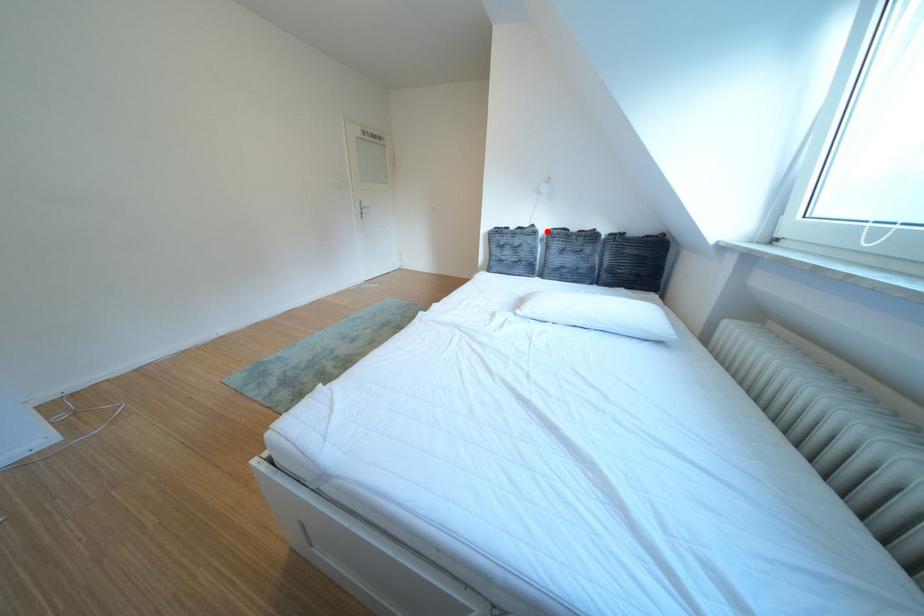
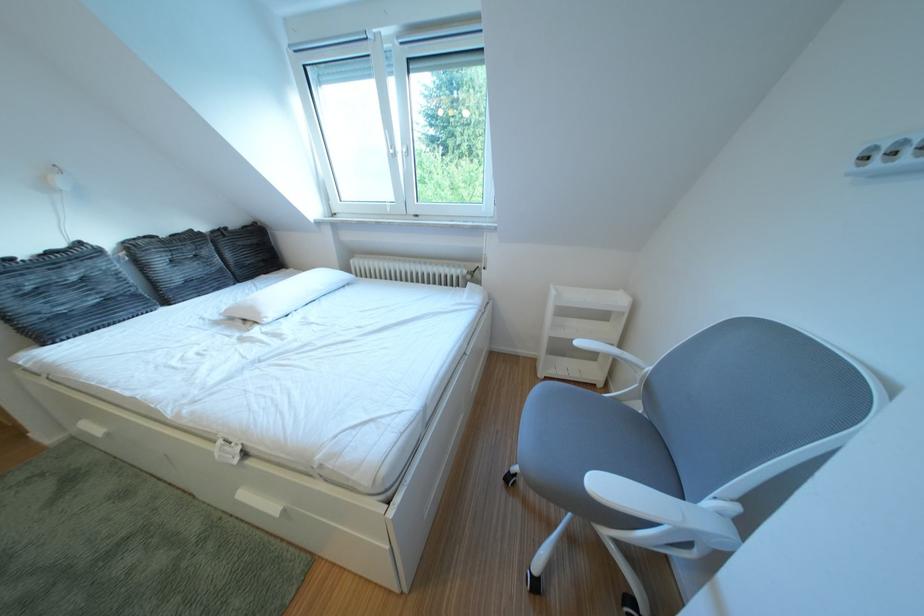
Find the pixel in the second image that matches the highlighted location in the first image.

(93, 249)